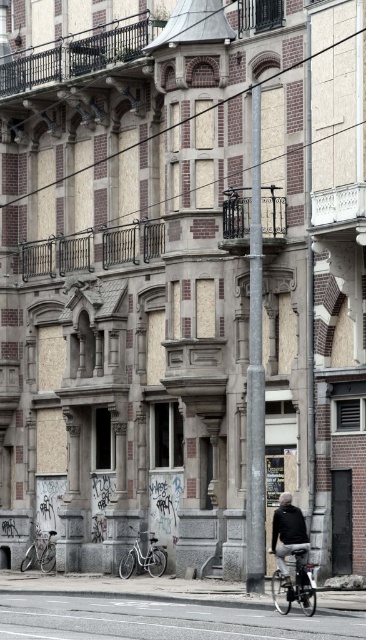
You are standing in front of the building and see the dark gray jacket at center. Where is the dark gray jacket at center located relative to the point marked at coordinates (288, 531)?

The dark gray jacket at center is located exactly at the point marked at coordinates (288, 531).

You are a delivery person trying to park your shiny metallic bicycle at center and white matte bicycle at lower center near the building. The space between the two bicycles is 1.2 meters. Can both bicycles fit side by side in this space?

The shiny metallic bicycle at center has a lesser width compared to white matte bicycle at lower center. Since the space between them is 1.2 meters, it depends on the combined widths of both bicycles. If their total width is less than or equal to 1.2 meters, they can fit. However, without knowing the exact widths, we cannot confirm for sure.